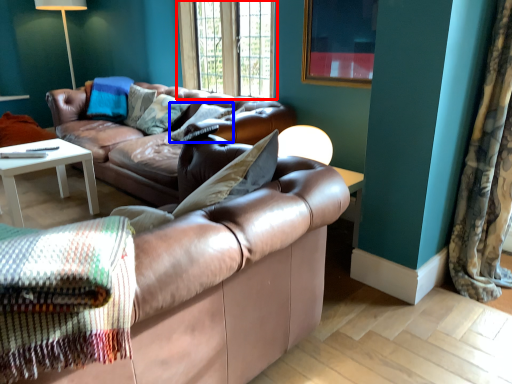
Question: Which point is closer to the camera, window (highlighted by a red box) or pillow (highlighted by a blue box)?

Choices:
 (A) window
 (B) pillow

Answer: (B)